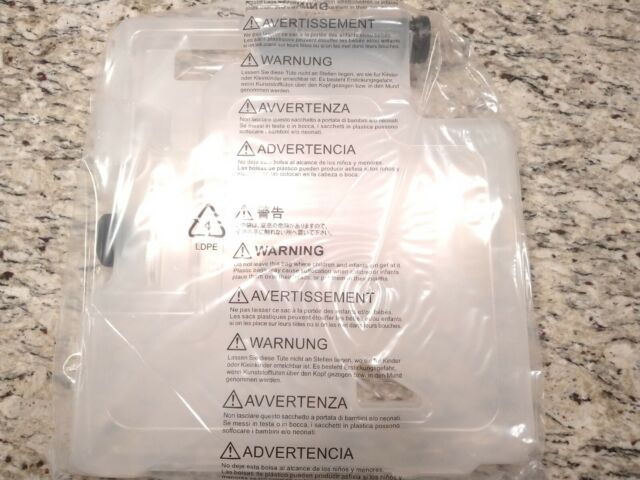
Where is `countertop`? This screenshot has height=480, width=640. countertop is located at coordinates (44, 83), (586, 102).